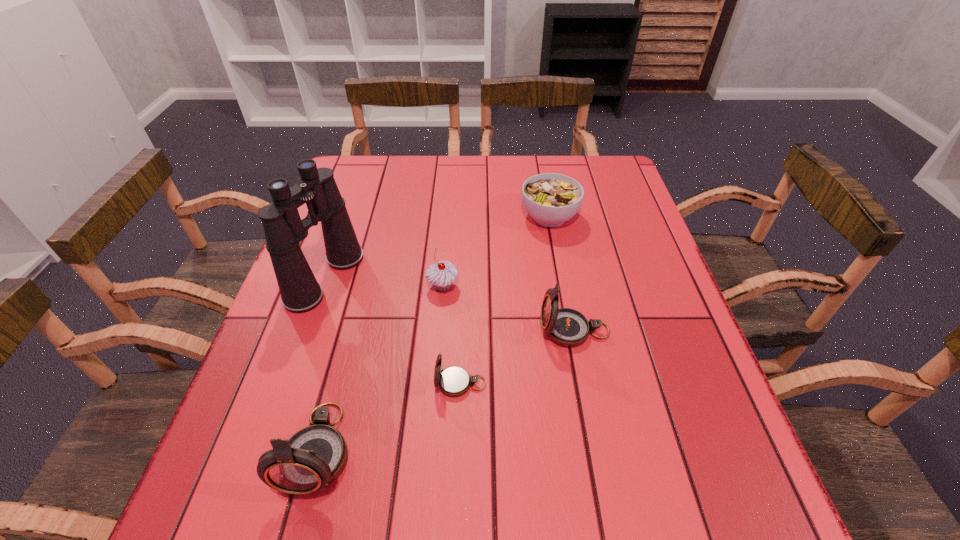
You are a GUI agent. You are given a task and a screenshot of the screen. Output one action in this format:
    pyautogui.click(x=<x>, y=<y>)
    Task: Click on the nearest object
    The image size is (960, 540).
    Given the screenshot: What is the action you would take?
    pyautogui.click(x=313, y=457)

This screenshot has height=540, width=960. In order to click on the nearest compass in this screenshot , I will do `click(313, 457)`.

Image resolution: width=960 pixels, height=540 pixels. In order to click on the second nearest compass in this screenshot , I will do `click(454, 381)`.

Find the location of `the shortest compass`. the shortest compass is located at coordinates (454, 381).

Identify the location of the farthest compass. This screenshot has width=960, height=540. (567, 327).

Identify the location of the third nearest object. The height and width of the screenshot is (540, 960). (567, 327).

You are a GUI agent. You are given a task and a screenshot of the screen. Output one action in this format:
    pyautogui.click(x=<x>, y=<y>)
    Task: Click on the farthest object
    This screenshot has width=960, height=540.
    Given the screenshot: What is the action you would take?
    (x=551, y=199)

In order to click on binoculars in this screenshot , I will do `click(300, 292)`.

Locate an element on the screen. The height and width of the screenshot is (540, 960). cupcake is located at coordinates (441, 275).

Image resolution: width=960 pixels, height=540 pixels. In order to click on vacant space located 0.080m on the face of the second compass from right to left in this screenshot , I will do `click(394, 383)`.